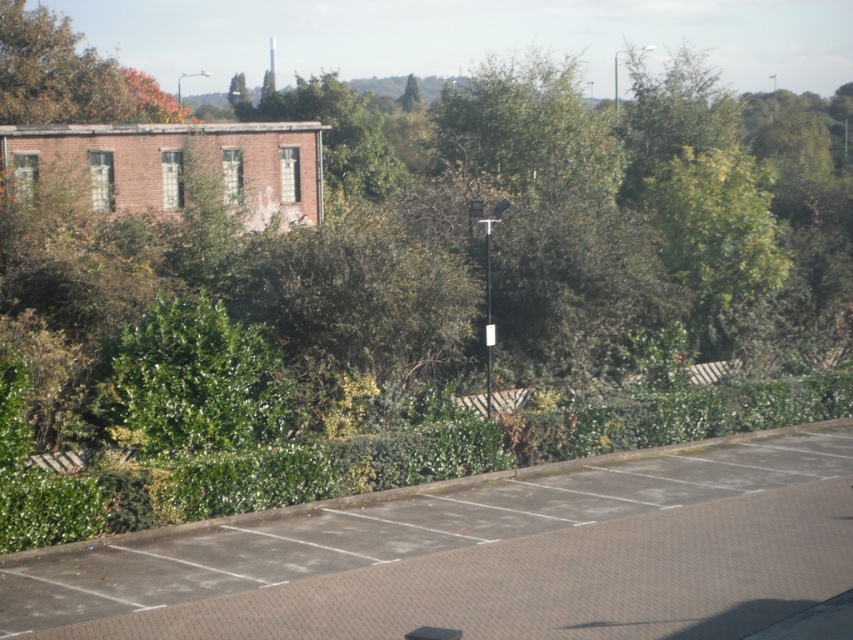
You are a gardener planning to water the green leafy tree at upper center. You need to place a hose from the brown textured pavement at lower center to the tree. Is the pavement below the tree a suitable spot to place the hose?

The brown textured pavement at lower center is located below the green leafy tree at upper center, so placing the hose on the pavement would position it directly under the tree, making it a suitable spot for watering.

You are driving a car that is 5 meters long. You want to park your car between the brown textured pavement at lower center and the metallic pole at center. Is there enough space for your car to fit entirely between them?

The distance between the brown textured pavement at lower center and the metallic pole at center is 6.71 meters. Since your car is 5 meters long, there is sufficient space for it to fit entirely between them.

You are standing at the point marked as point (483, 556) in the image. What type of surface are you standing on?

The point (483, 556) is on brown textured pavement at lower center, so you are standing on brown textured pavement.